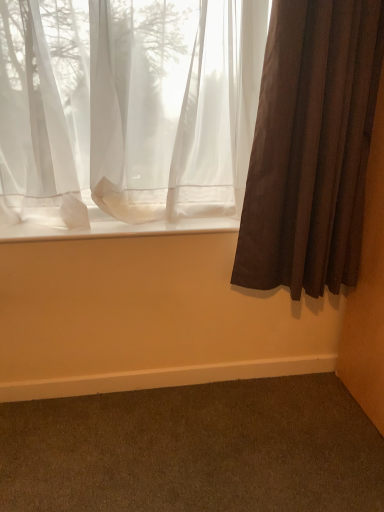
In order to face white sheer fabric at lower center, should I rotate leftwards or rightwards?

It's best to rotate left around 9.029 degrees.

The width and height of the screenshot is (384, 512). Describe the element at coordinates (112, 228) in the screenshot. I see `white sheer fabric at lower center` at that location.

What is the approximate height of dark brown carpet at lower right?

1.70 inches.

Identify the location of white sheer fabric at lower center. 112,228.

Which object is closer to the camera, brown textured curtain at right, which is the first curtain from right to left, or dark brown carpet at lower right?

dark brown carpet at lower right is in front.

Between brown textured curtain at right, which is the first curtain from right to left, and dark brown carpet at lower right, which one appears on the left side from the viewer's perspective?

From the viewer's perspective, dark brown carpet at lower right appears more on the left side.

How distant is brown textured curtain at right, the 2th curtain positioned from the left, from dark brown carpet at lower right?

A distance of 37.52 inches exists between brown textured curtain at right, the 2th curtain positioned from the left, and dark brown carpet at lower right.

From the image's perspective, which object appears higher, brown textured curtain at right, the 2th curtain positioned from the left, or dark brown carpet at lower right?

brown textured curtain at right, the 2th curtain positioned from the left, is shown above in the image.

In order to click on plain that is in front of the white sheer fabric at lower center in this screenshot , I will do `click(194, 450)`.

Consider the image. From the image's perspective, between white sheer fabric at lower center and dark brown carpet at lower right, who is located below?

dark brown carpet at lower right.

From the picture: Considering the sizes of objects white sheer fabric at lower center and dark brown carpet at lower right in the image provided, who is shorter, white sheer fabric at lower center or dark brown carpet at lower right?

white sheer fabric at lower center is shorter.

Is white sheer fabric at lower center behind dark brown carpet at lower right?

Yes, it is behind dark brown carpet at lower right.

Identify the location of curtain that is the 1st object located above the white sheer fabric at lower center (from the image's perspective). Image resolution: width=384 pixels, height=512 pixels. (311, 147).

Looking at the image, does brown textured curtain at right, which is the first curtain from right to left, seem bigger or smaller compared to white sheer fabric at lower center?

brown textured curtain at right, which is the first curtain from right to left, is bigger than white sheer fabric at lower center.

From the image's perspective, which one is positioned higher, brown textured curtain at right, the 2th curtain positioned from the left, or white sheer fabric at lower center?

From the image's view, brown textured curtain at right, the 2th curtain positioned from the left, is above.

From a real-world perspective, which object stands above the other?

In real-world perspective, sheer white curtain at upper left, the 1th curtain in the left-to-right sequence, is above.

Which is more to the right, sheer white curtain at upper left, positioned as the 2th curtain in right-to-left order, or dark brown carpet at lower right?

Positioned to the right is dark brown carpet at lower right.

Does sheer white curtain at upper left, positioned as the 2th curtain in right-to-left order, have a larger size compared to dark brown carpet at lower right?

Correct, sheer white curtain at upper left, positioned as the 2th curtain in right-to-left order, is larger in size than dark brown carpet at lower right.

From the image's perspective, which object appears higher, sheer white curtain at upper left, the 1th curtain in the left-to-right sequence, or dark brown carpet at lower right?

sheer white curtain at upper left, the 1th curtain in the left-to-right sequence, appears higher in the image.

Is brown textured curtain at right, which is the first curtain from right to left, a part of dark brown carpet at lower right?

No, dark brown carpet at lower right does not contain brown textured curtain at right, which is the first curtain from right to left.

How distant is dark brown carpet at lower right from brown textured curtain at right, the 2th curtain positioned from the left?

dark brown carpet at lower right and brown textured curtain at right, the 2th curtain positioned from the left, are 37.52 inches apart.

Is dark brown carpet at lower right oriented away from brown textured curtain at right, which is the first curtain from right to left?

No, brown textured curtain at right, which is the first curtain from right to left, is not at the back of dark brown carpet at lower right.

How many degrees apart are the facing directions of dark brown carpet at lower right and brown textured curtain at right, which is the first curtain from right to left?

The angle between the facing direction of dark brown carpet at lower right and the facing direction of brown textured curtain at right, which is the first curtain from right to left, is 88.5 degrees.

Is brown textured curtain at right, the 2th curtain positioned from the left, not within sheer white curtain at upper left, positioned as the 2th curtain in right-to-left order?

Yes.

Visually, is brown textured curtain at right, which is the first curtain from right to left, positioned to the left or to the right of sheer white curtain at upper left, positioned as the 2th curtain in right-to-left order?

Based on their positions, brown textured curtain at right, which is the first curtain from right to left, is located to the right of sheer white curtain at upper left, positioned as the 2th curtain in right-to-left order.

The height and width of the screenshot is (512, 384). Find the location of `curtain lying behind the brown textured curtain at right, the 2th curtain positioned from the left`. curtain lying behind the brown textured curtain at right, the 2th curtain positioned from the left is located at coordinates (128, 106).

From their relative heights in the image, would you say sheer white curtain at upper left, positioned as the 2th curtain in right-to-left order, is taller or shorter than white sheer fabric at lower center?

Clearly, sheer white curtain at upper left, positioned as the 2th curtain in right-to-left order, is taller compared to white sheer fabric at lower center.

Locate an element on the screen. This screenshot has width=384, height=512. curtain that is the 2nd one when counting upward from the white sheer fabric at lower center (from the image's perspective) is located at coordinates (128, 106).

What's the angular difference between sheer white curtain at upper left, positioned as the 2th curtain in right-to-left order, and white sheer fabric at lower center's facing directions?

sheer white curtain at upper left, positioned as the 2th curtain in right-to-left order, and white sheer fabric at lower center are facing 0.249 degrees away from each other.

In the scene shown: Is sheer white curtain at upper left, the 1th curtain in the left-to-right sequence, positioned beyond the bounds of white sheer fabric at lower center?

Indeed, sheer white curtain at upper left, the 1th curtain in the left-to-right sequence, is completely outside white sheer fabric at lower center.

Image resolution: width=384 pixels, height=512 pixels. In the image, there is a brown textured curtain at right, which is the first curtain from right to left. In order to click on plain below it (from the image's perspective) in this screenshot , I will do `click(194, 450)`.

The height and width of the screenshot is (512, 384). I want to click on window sill behind the dark brown carpet at lower right, so click(112, 228).

Estimate the real-world distances between objects in this image. Which object is further from brown textured curtain at right, the 2th curtain positioned from the left, white sheer fabric at lower center or dark brown carpet at lower right?

dark brown carpet at lower right lies further to brown textured curtain at right, the 2th curtain positioned from the left, than the other object.

Which object lies further to the anchor point dark brown carpet at lower right, white sheer fabric at lower center or sheer white curtain at upper left, positioned as the 2th curtain in right-to-left order?

sheer white curtain at upper left, positioned as the 2th curtain in right-to-left order, is positioned further to the anchor dark brown carpet at lower right.

Consider the image. From the image, which object appears to be nearer to white sheer fabric at lower center, brown textured curtain at right, the 2th curtain positioned from the left, or sheer white curtain at upper left, positioned as the 2th curtain in right-to-left order?

sheer white curtain at upper left, positioned as the 2th curtain in right-to-left order.

Which object lies further to the anchor point white sheer fabric at lower center, brown textured curtain at right, the 2th curtain positioned from the left, or dark brown carpet at lower right?

Based on the image, dark brown carpet at lower right appears to be further to white sheer fabric at lower center.

Looking at the image, which one is located further to brown textured curtain at right, the 2th curtain positioned from the left, white sheer fabric at lower center or sheer white curtain at upper left, the 1th curtain in the left-to-right sequence?

white sheer fabric at lower center is further to brown textured curtain at right, the 2th curtain positioned from the left.

In the scene shown: Estimate the real-world distances between objects in this image. Which object is further from white sheer fabric at lower center, sheer white curtain at upper left, positioned as the 2th curtain in right-to-left order, or dark brown carpet at lower right?

The object further to white sheer fabric at lower center is dark brown carpet at lower right.

Which object lies nearer to the anchor point white sheer fabric at lower center, sheer white curtain at upper left, positioned as the 2th curtain in right-to-left order, or brown textured curtain at right, which is the first curtain from right to left?

Based on the image, sheer white curtain at upper left, positioned as the 2th curtain in right-to-left order, appears to be nearer to white sheer fabric at lower center.

Estimate the real-world distances between objects in this image. Which object is further from sheer white curtain at upper left, positioned as the 2th curtain in right-to-left order, brown textured curtain at right, the 2th curtain positioned from the left, or white sheer fabric at lower center?

brown textured curtain at right, the 2th curtain positioned from the left, lies further to sheer white curtain at upper left, positioned as the 2th curtain in right-to-left order, than the other object.

Where is `curtain between sheer white curtain at upper left, the 1th curtain in the left-to-right sequence, and dark brown carpet at lower right from top to bottom`? The image size is (384, 512). curtain between sheer white curtain at upper left, the 1th curtain in the left-to-right sequence, and dark brown carpet at lower right from top to bottom is located at coordinates (311, 147).

The height and width of the screenshot is (512, 384). I want to click on window sill between brown textured curtain at right, the 2th curtain positioned from the left, and dark brown carpet at lower right vertically, so click(x=112, y=228).

The image size is (384, 512). I want to click on curtain between white sheer fabric at lower center and brown textured curtain at right, which is the first curtain from right to left, from left to right, so click(x=128, y=106).

Locate an element on the screen. The width and height of the screenshot is (384, 512). window sill between sheer white curtain at upper left, positioned as the 2th curtain in right-to-left order, and dark brown carpet at lower right from top to bottom is located at coordinates (112, 228).